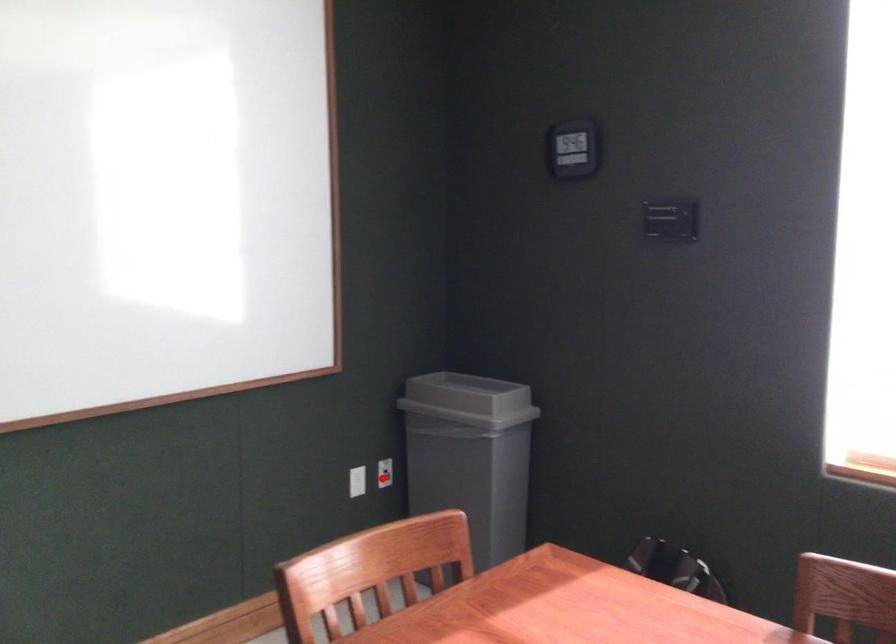
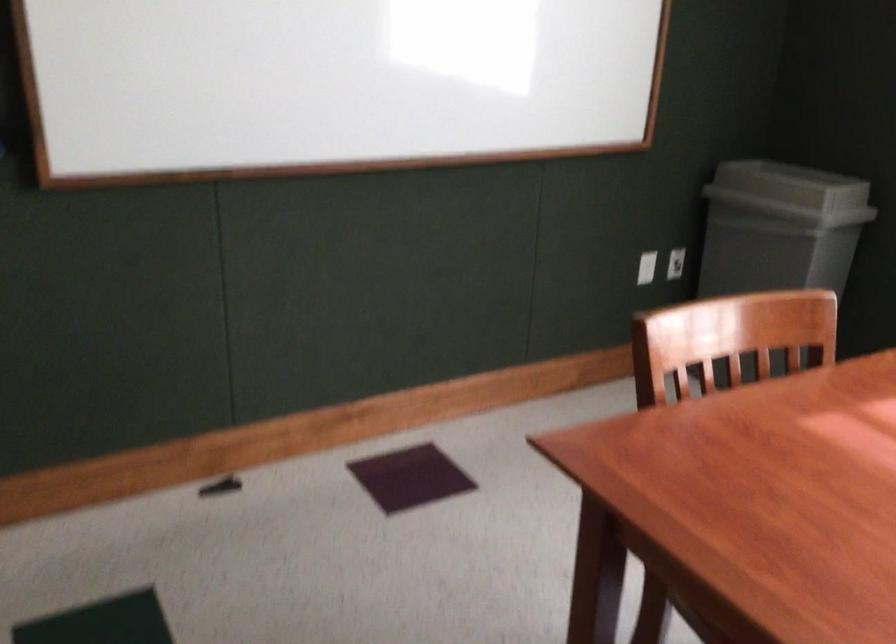
Locate, in the second image, the point that corresponds to the highlighted location in the first image.

(675, 263)